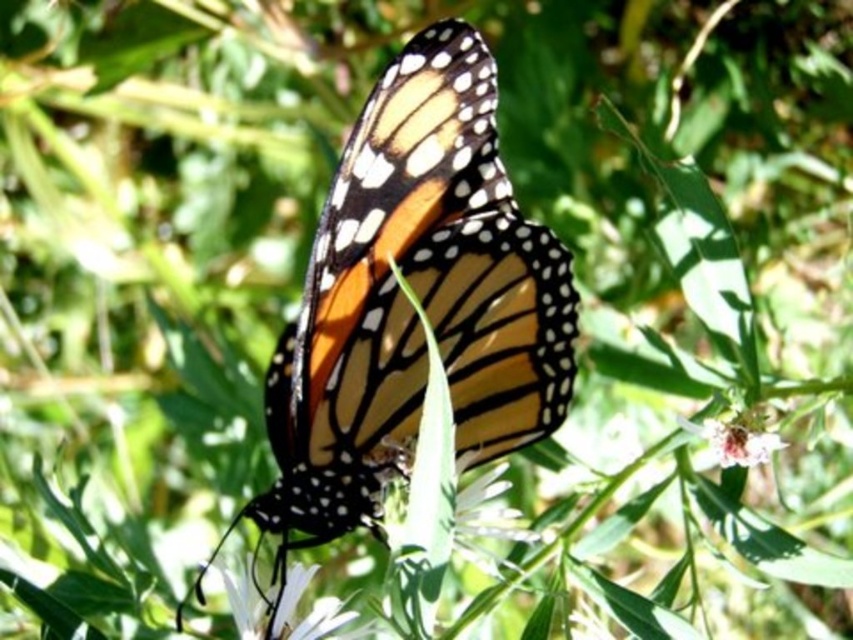
You are a photographer trying to capture the monarch butterfly at center. You notice a point at coordinates (x=410, y=305) in your viewfinder. Based on the scene description, what part of the butterfly is this point likely located on?

The point at coordinates (x=410, y=305) is on the orange and black spotted butterfly at center.

You are taking a photo of the monarch butterfly and want to focus on the point closer to the camera. Which point should you choose between point [517,310] and point [496,557]?

Point [517,310] is further to the camera than point [496,557], so you should choose point [517,310] to focus on the closer point.

You are a photographer trying to capture a close shot of the orange and black spotted butterfly at center and the white textured flower at center. Your camera has a depth of field setting that can focus on objects within a 6 inch range. If you focus on the butterfly, will the flower be in focus?

The orange and black spotted butterfly at center is 7.55 inches away from the white textured flower at center. Since the camera can only focus within a 6 inch range, focusing on the butterfly would mean the flower is outside the 6 inch focus range, so it would not be in focus.